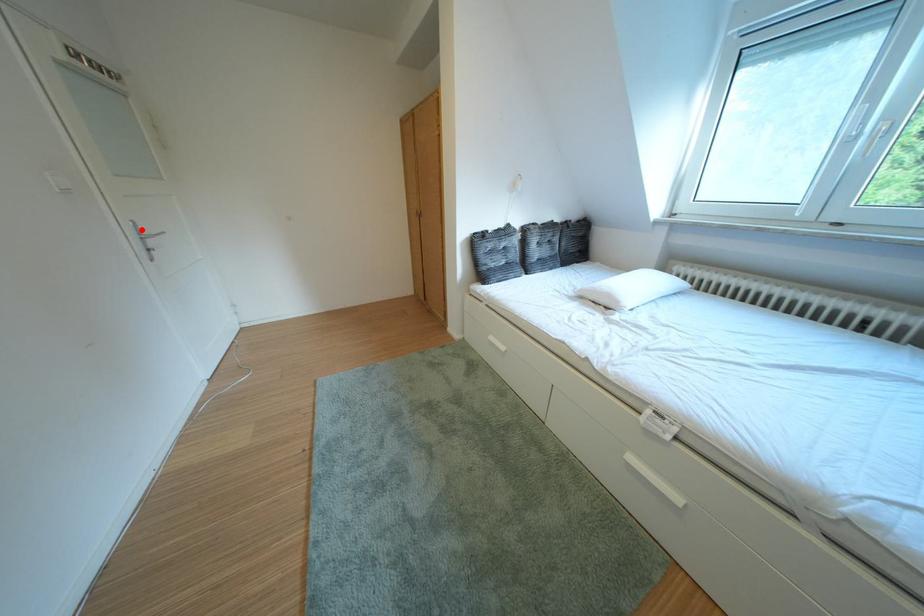
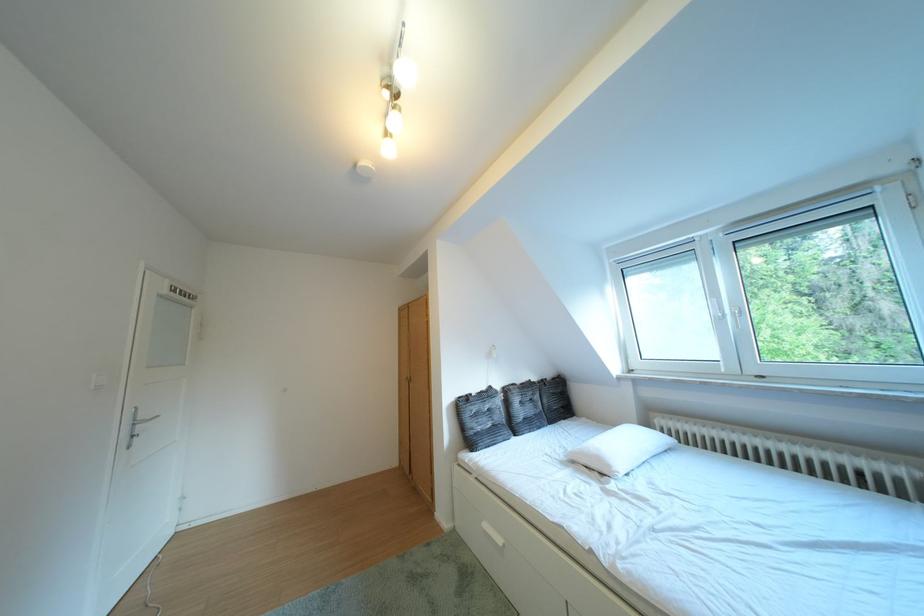
Locate, in the second image, the point that corresponds to the highlighted location in the first image.

(141, 418)